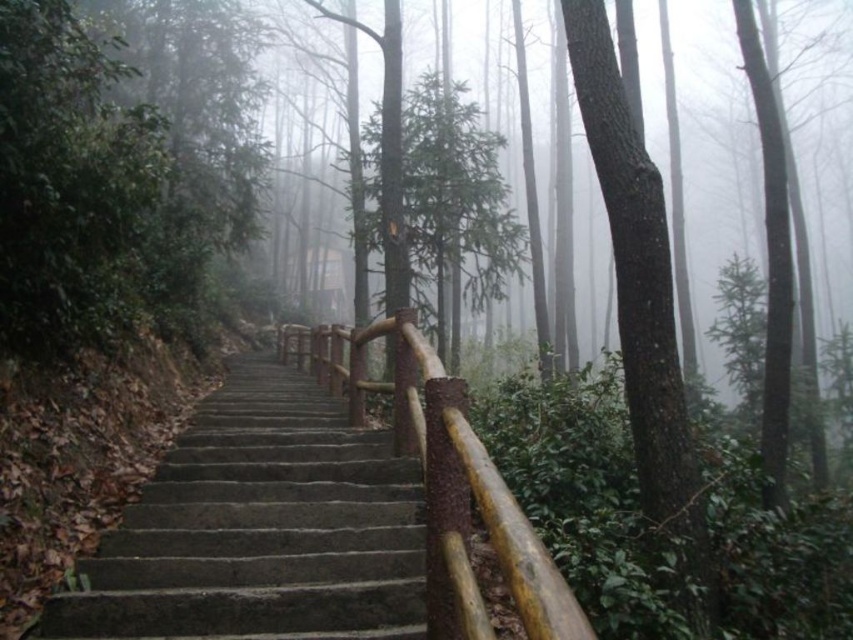
You are a hiker trying to navigate through the forest. You see the dark gray concrete stairs at center and the green matte tree at center. Which one is taller?

The dark gray concrete stairs at center is shorter than the green matte tree at center, so the green matte tree at center is taller.